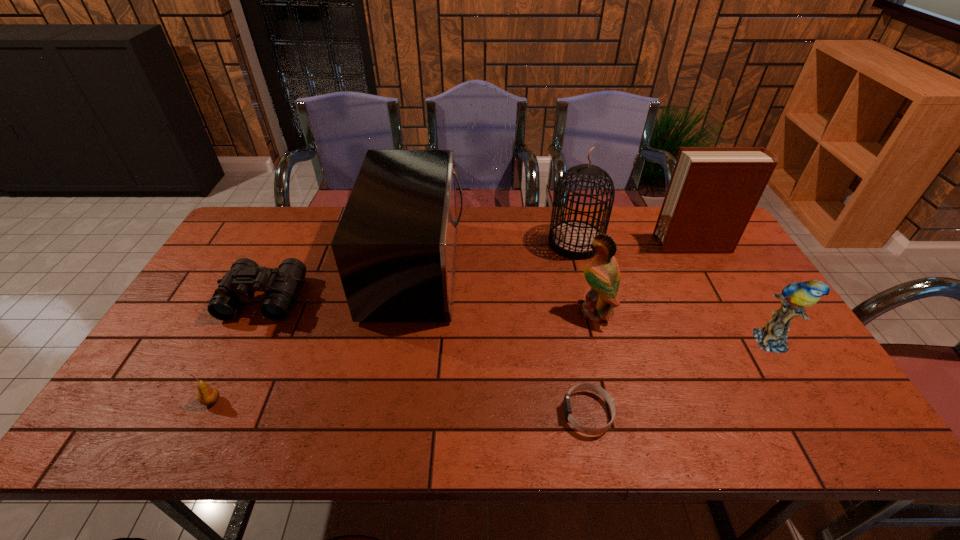
Find the location of a particular element. This screenshot has height=540, width=960. birdcage is located at coordinates (572, 238).

Find the location of a particular element. Image resolution: width=960 pixels, height=540 pixels. hardback book is located at coordinates (713, 191).

Identify the location of the sixth object from right to left. (395, 247).

Image resolution: width=960 pixels, height=540 pixels. Identify the location of the left parrot. (603, 275).

Locate an element on the screen. This screenshot has height=540, width=960. the right parrot is located at coordinates (772, 337).

Where is `binoculars`? The image size is (960, 540). binoculars is located at coordinates (281, 285).

The image size is (960, 540). I want to click on pear, so click(x=207, y=395).

Where is `the shortest object`? the shortest object is located at coordinates (582, 386).

Find the location of a particular element. Image resolution: width=960 pixels, height=540 pixels. free space located 0.080m on the left of the birdcage is located at coordinates 524,242.

The width and height of the screenshot is (960, 540). In order to click on vacant space located 0.330m on the open cover of the hardback book in this screenshot , I will do `click(556, 245)`.